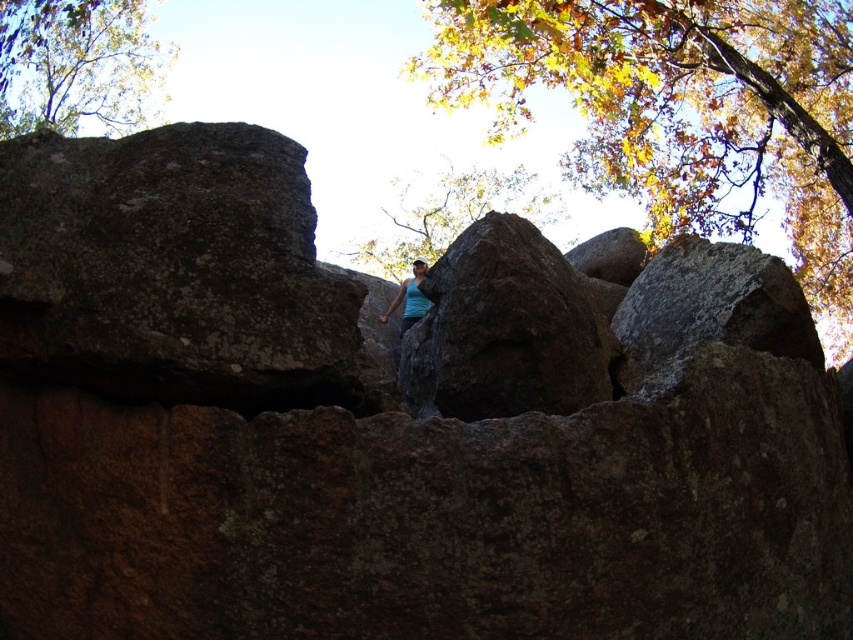
You are standing in the rocky landscape described. If you look at the coordinates provided in the image, where would you find the brown rough rock at center?

The brown rough rock at center is located at coordinates point (506,330).

You are standing in the rocky landscape and want to take a photo of the brown textured rock at upper center. However, the brown rough rock at center is blocking your view. Can you move around to see it clearly?

The brown rough rock at center is closer to the viewer than the brown textured rock at upper center. To see the brown textured rock at upper center clearly, you need to move around the brown rough rock at center so it no longer obstructs your view.

You are standing in the rocky landscape described. There is a point marked at coordinates (506,330). What object is located exactly at that point?

The brown rough rock at center is located exactly at point (506,330).